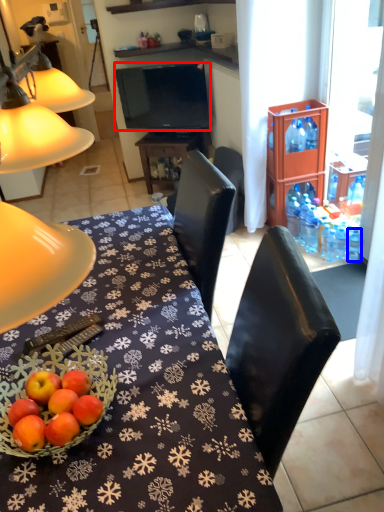
Question: Which object is closer to the camera taking this photo, television (highlighted by a red box) or bottle (highlighted by a blue box)?

Choices:
 (A) television
 (B) bottle

Answer: (B)